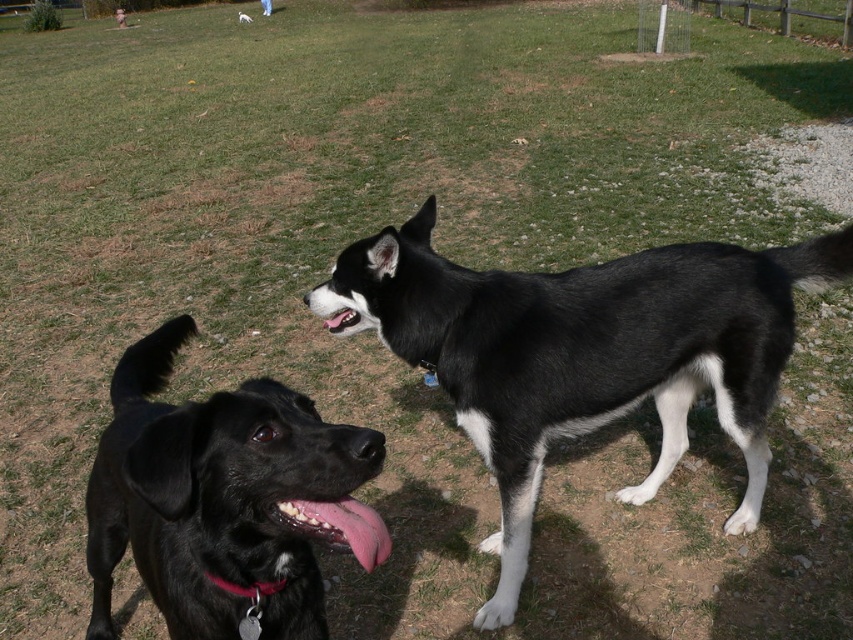
Question: Which point is farther from the camera taking this photo?

Choices:
 (A) (281, 580)
 (B) (790, 292)
 (C) (334, 320)
 (D) (242, 16)

Answer: (D)

Question: Which object is positioned farthest from the black glossy teeth at center?

Choices:
 (A) black glossy dog at center
 (B) red leather collar at lower left

Answer: (A)

Question: Is the position of black matte dog at lower left less distant than that of red leather collar at lower left?

Choices:
 (A) yes
 (B) no

Answer: (A)

Question: Which of the following is the farthest from the observer?

Choices:
 (A) black matte dog at center
 (B) black matte dog at lower left
 (C) red leather collar at lower left

Answer: (A)

Question: Is black/white fur dog at center in front of black glossy dog at center?

Choices:
 (A) yes
 (B) no

Answer: (A)

Question: Does black/white fur dog at center have a lesser width compared to pink glossy tongue at lower center?

Choices:
 (A) no
 (B) yes

Answer: (A)